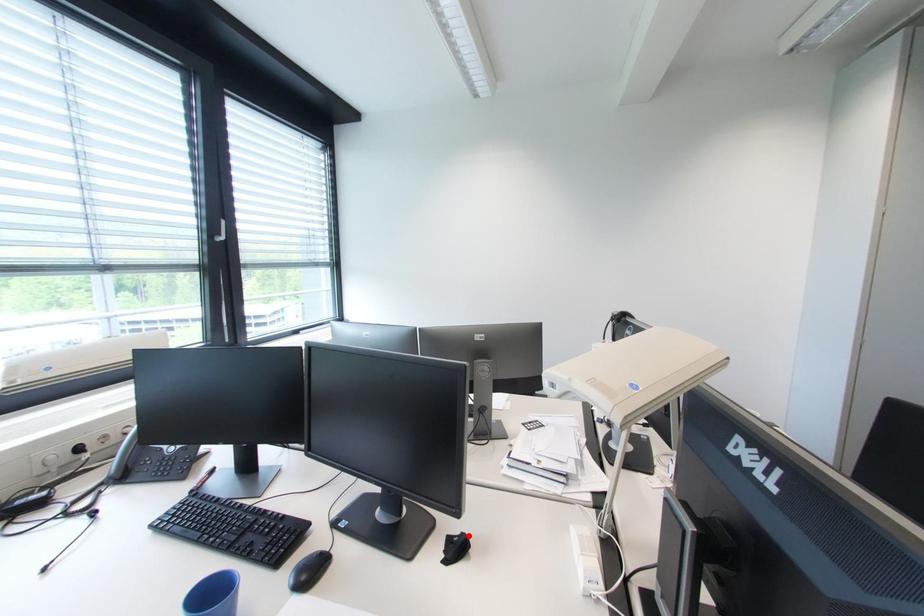
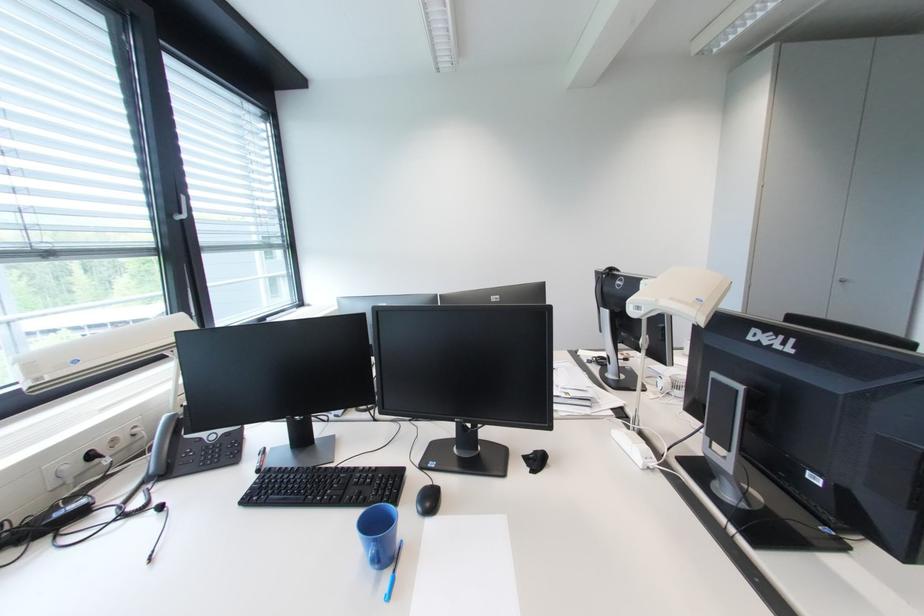
Where in the second image is the point corresponding to the highlighted location from the first image?

(541, 454)